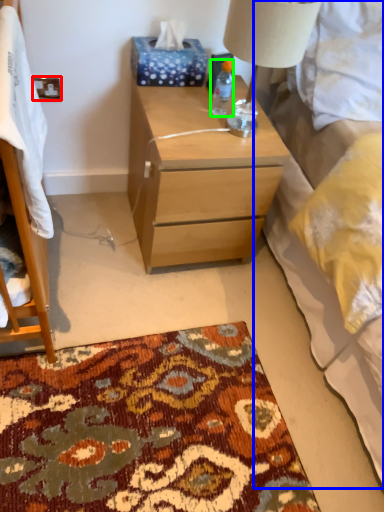
Question: Based on their relative distances, which object is nearer to power outlet (highlighted by a red box)? Choose from bed (highlighted by a blue box) and bottle (highlighted by a green box).

Choices:
 (A) bed
 (B) bottle

Answer: (B)